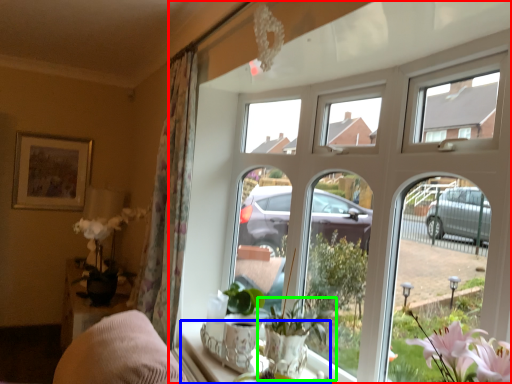
Question: Considering the real-world distances, which object is farthest from window (highlighted by a red box)? window sill (highlighted by a blue box) or houseplant (highlighted by a green box)?

Choices:
 (A) window sill
 (B) houseplant

Answer: (B)